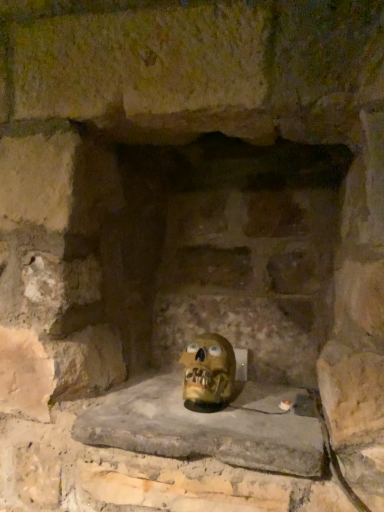
Where is `free space to the left of matte yellow skull at center`? free space to the left of matte yellow skull at center is located at coordinates (132, 405).